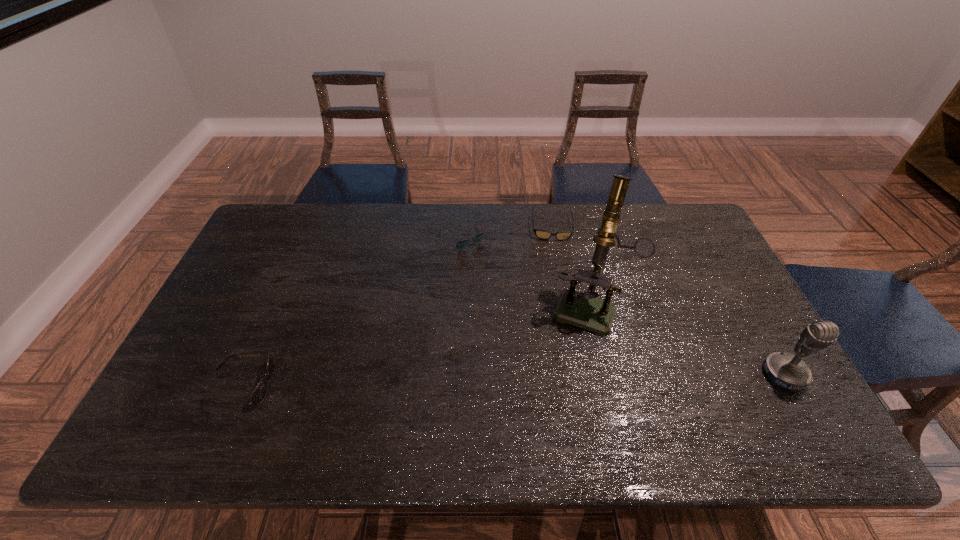
Where is `vacant space located on the lenses of the second object from left to right`? The width and height of the screenshot is (960, 540). vacant space located on the lenses of the second object from left to right is located at coordinates (511, 295).

The height and width of the screenshot is (540, 960). Identify the location of vacant space located 0.100m on the lenses of the second object from left to right. (489, 268).

Locate an element on the screen. The width and height of the screenshot is (960, 540). vacant region located at the eyepiece of the microscope is located at coordinates (570, 359).

Find the location of `vacant space located at the eyepiece of the microscope`. vacant space located at the eyepiece of the microscope is located at coordinates (573, 350).

Where is `vacant space located at the eyepiece of the microscope`? The image size is (960, 540). vacant space located at the eyepiece of the microscope is located at coordinates (562, 383).

Image resolution: width=960 pixels, height=540 pixels. I want to click on free space located on the front-facing side of the rightmost sunglasses, so click(x=559, y=326).

At what (x,y) coordinates should I click in order to perform the action: click on free space located 0.070m on the front-facing side of the rightmost sunglasses. Please return your answer as a coordinate pair (x, y). The height and width of the screenshot is (540, 960). Looking at the image, I should click on (554, 256).

What are the coordinates of `vacant space located on the front-facing side of the rightmost sunglasses` in the screenshot? It's located at (556, 278).

Locate an element on the screen. This screenshot has width=960, height=540. sunglasses that is at the near edge is located at coordinates 259,393.

Where is `microphone that is at the near edge`? microphone that is at the near edge is located at coordinates (785, 370).